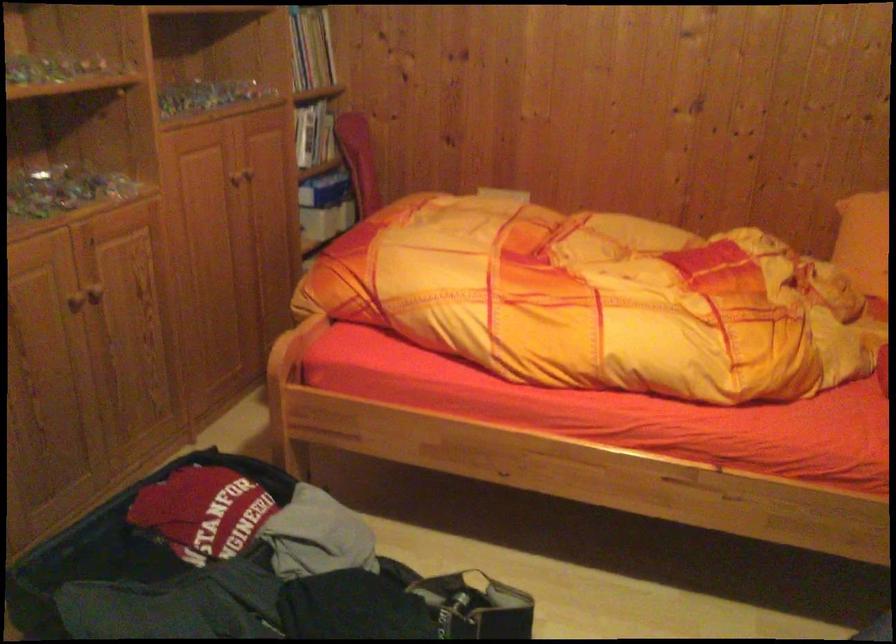
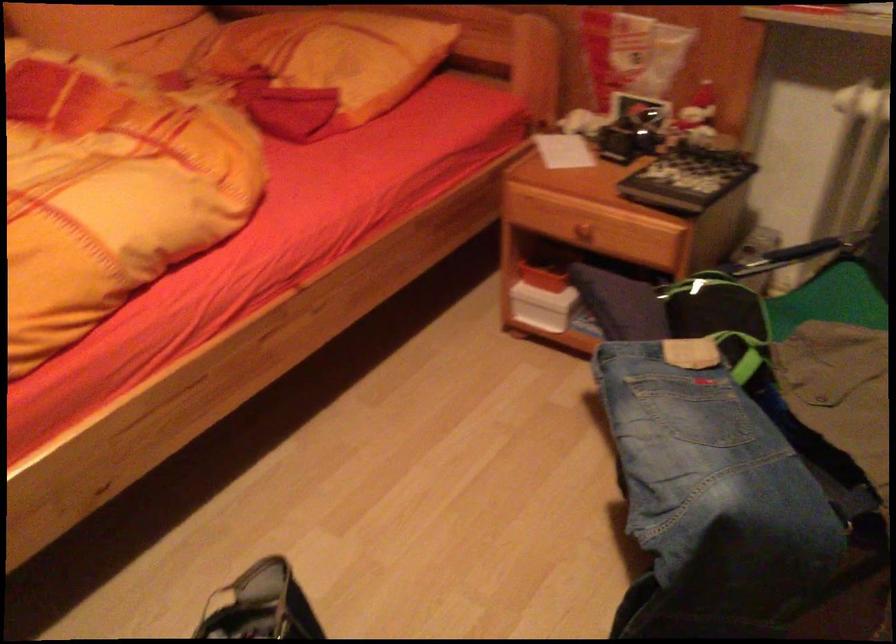
Based on the continuous images, in which direction is the camera rotating?

The rotation direction of the camera is right-down.